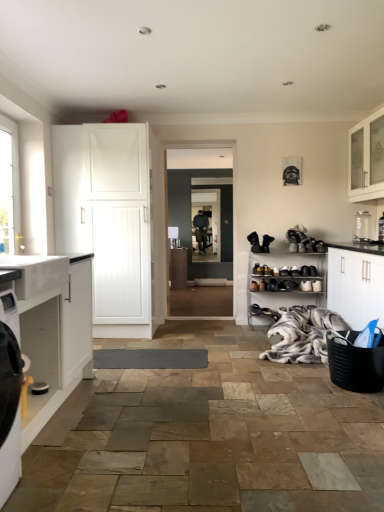
Question: Would you say black leather shoe at center is a long distance from black leather shoe at center, which is the second shoe from right to left?

Choices:
 (A) yes
 (B) no

Answer: (B)

Question: From a real-world perspective, is black leather shoe at center positioned under black leather shoe at center, which is the second shoe from right to left, based on gravity?

Choices:
 (A) no
 (B) yes

Answer: (B)

Question: Considering the relative sizes of black leather shoe at center and black leather shoe at center, which is the 6th shoe from left to right, in the image provided, is black leather shoe at center smaller than black leather shoe at center, which is the 6th shoe from left to right,?

Choices:
 (A) no
 (B) yes

Answer: (B)

Question: Considering the relative positions of black leather shoe at center and black leather shoe at center, which is the second shoe from right to left, in the image provided, is black leather shoe at center to the left of black leather shoe at center, which is the second shoe from right to left, from the viewer's perspective?

Choices:
 (A) no
 (B) yes

Answer: (B)

Question: Would you say black leather shoe at center contains black leather shoe at center, which is the 6th shoe from left to right?

Choices:
 (A) yes
 (B) no

Answer: (B)

Question: Is black leather shoe at center in front of black leather shoe at center, which is the second shoe from right to left?

Choices:
 (A) yes
 (B) no

Answer: (B)

Question: Does metallic silver shoe rack at lower right, which ranks as the third cabinetry in right-to-left order, lie behind shiny black shoe at lower right, marked as the 1th shoe in a left-to-right arrangement?

Choices:
 (A) no
 (B) yes

Answer: (A)

Question: Are metallic silver shoe rack at lower right, which appears as the fifth cabinetry when viewed from the front, and shiny black shoe at lower right, placed as the seventh shoe when sorted from right to left, beside each other?

Choices:
 (A) no
 (B) yes

Answer: (A)

Question: Can you confirm if metallic silver shoe rack at lower right, which appears as the fifth cabinetry when viewed from the front, is wider than shiny black shoe at lower right, placed as the seventh shoe when sorted from right to left?

Choices:
 (A) no
 (B) yes

Answer: (B)

Question: Are metallic silver shoe rack at lower right, the second cabinetry from the back, and shiny black shoe at lower right, placed as the seventh shoe when sorted from right to left, located far from each other?

Choices:
 (A) no
 (B) yes

Answer: (A)

Question: From the image's perspective, does metallic silver shoe rack at lower right, which ranks as the third cabinetry in right-to-left order, appear lower than shiny black shoe at lower right, placed as the seventh shoe when sorted from right to left?

Choices:
 (A) yes
 (B) no

Answer: (A)

Question: From a real-world perspective, is metallic silver shoe rack at lower right, which is counted as the fourth cabinetry, starting from the left, on shiny black shoe at lower right, marked as the 1th shoe in a left-to-right arrangement?

Choices:
 (A) yes
 (B) no

Answer: (B)

Question: Considering the relative positions of shiny black shoe at center, acting as the fifth shoe starting from the right, and black leather shoe at center in the image provided, is shiny black shoe at center, acting as the fifth shoe starting from the right, in front of black leather shoe at center?

Choices:
 (A) yes
 (B) no

Answer: (A)